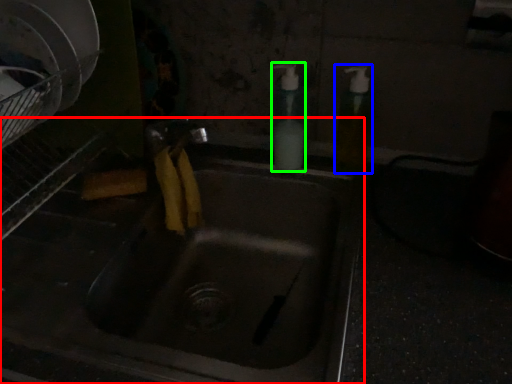
Question: Considering the real-world distances, which object is closest to sink (highlighted by a red box)? soap dispenser (highlighted by a blue box) or soap dispenser (highlighted by a green box).

Choices:
 (A) soap dispenser
 (B) soap dispenser

Answer: (B)